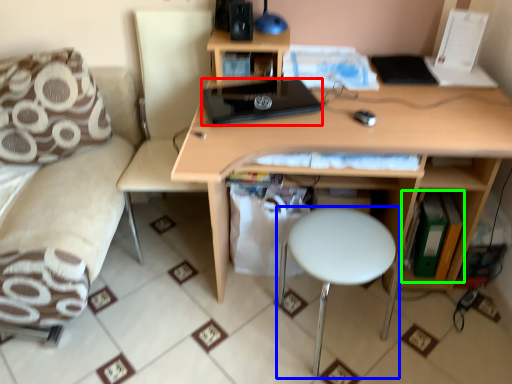
Question: Which is farther away from laptop (highlighted by a red box)? stool (highlighted by a blue box) or book (highlighted by a green box)?

Choices:
 (A) stool
 (B) book

Answer: (B)